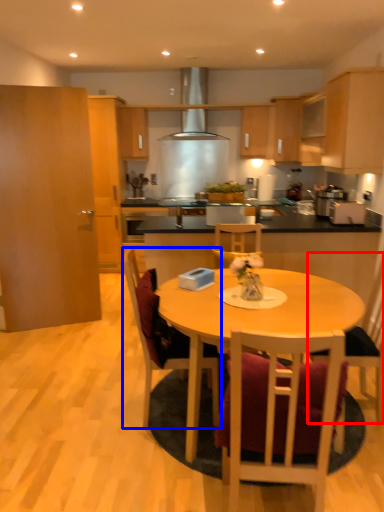
Question: Which object appears closest to the camera in this image, chair (highlighted by a red box) or chair (highlighted by a blue box)?

Choices:
 (A) chair
 (B) chair

Answer: (B)